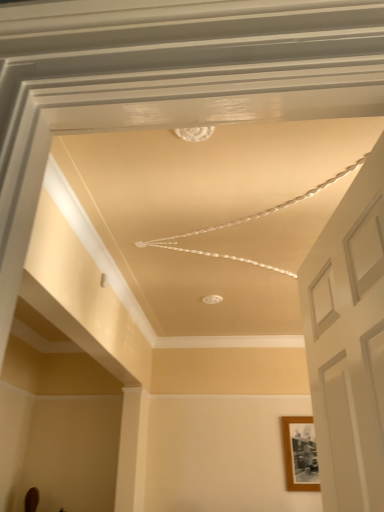
Based on the photo, what is the approximate height of white matte door at right?

It is 30.46 inches.

The width and height of the screenshot is (384, 512). I want to click on white matte door at right, so click(x=349, y=343).

This screenshot has width=384, height=512. Describe the element at coordinates (349, 343) in the screenshot. I see `white matte door at right` at that location.

This screenshot has width=384, height=512. What do you see at coordinates (300, 454) in the screenshot?
I see `wooden photo frame at right` at bounding box center [300, 454].

Locate an element on the screen. This screenshot has width=384, height=512. wooden photo frame at right is located at coordinates (300, 454).

I want to click on white matte door at right, so point(349,343).

Is white matte door at right at the left side of wooden photo frame at right?

Yes.

Does white matte door at right lie in front of wooden photo frame at right?

Yes, it is in front of wooden photo frame at right.

Does point (308, 311) come behind point (310, 442)?

That is False.

From the image's perspective, is white matte door at right above wooden photo frame at right?

Yes, from the image's perspective, white matte door at right is over wooden photo frame at right.

From a real-world perspective, is white matte door at right located higher than wooden photo frame at right?

Indeed, from a real-world perspective, white matte door at right stands above wooden photo frame at right.

Considering the sizes of objects white matte door at right and wooden photo frame at right in the image provided, who is thinner, white matte door at right or wooden photo frame at right?

Thinner between the two is wooden photo frame at right.

Does white matte door at right have a lesser height compared to wooden photo frame at right?

Incorrect, the height of white matte door at right does not fall short of that of wooden photo frame at right.

Which of these two, white matte door at right or wooden photo frame at right, is bigger?

white matte door at right is bigger.

Is white matte door at right positioned beyond the bounds of wooden photo frame at right?

Yes, white matte door at right is not within wooden photo frame at right.

Is white matte door at right with wooden photo frame at right?

They are not placed beside each other.

Is white matte door at right oriented towards wooden photo frame at right?

No.

What's the angular difference between white matte door at right and wooden photo frame at right's facing directions?

The angular difference between white matte door at right and wooden photo frame at right is 81.4 degrees.

Measure the distance from white matte door at right to wooden photo frame at right.

9.97 feet.

Find the location of `picture frame below the white matte door at right (from the image's perspective)`. picture frame below the white matte door at right (from the image's perspective) is located at coordinates (300, 454).

Between wooden photo frame at right and white matte door at right, which one appears on the left side from the viewer's perspective?

white matte door at right is more to the left.

Considering the positions of objects wooden photo frame at right and white matte door at right in the image provided, who is in front, wooden photo frame at right or white matte door at right?

white matte door at right is more forward.

Is point (296, 452) closer to camera compared to point (353, 215)?

That is False.

From the image's perspective, which object appears higher, wooden photo frame at right or white matte door at right?

white matte door at right, from the image's perspective.

Based on the photo, from a real-world perspective, is wooden photo frame at right over white matte door at right?

No, from a real-world perspective, wooden photo frame at right is not over white matte door at right

Considering the relative sizes of wooden photo frame at right and white matte door at right in the image provided, is wooden photo frame at right thinner than white matte door at right?

Indeed, wooden photo frame at right has a lesser width compared to white matte door at right.

Is wooden photo frame at right shorter than white matte door at right?

Indeed, wooden photo frame at right has a lesser height compared to white matte door at right.

Is wooden photo frame at right bigger than white matte door at right?

Incorrect, wooden photo frame at right is not larger than white matte door at right.

Can white matte door at right be found inside wooden photo frame at right?

No, wooden photo frame at right does not contain white matte door at right.

Is wooden photo frame at right placed right next to white matte door at right?

No, wooden photo frame at right is not touching white matte door at right.

Is wooden photo frame at right positioned with its back to white matte door at right?

wooden photo frame at right is not turned away from white matte door at right.

Measure the distance from wooden photo frame at right to white matte door at right.

wooden photo frame at right is 9.97 feet from white matte door at right.

Where is `door above the wooden photo frame at right (from the image's perspective)`? The image size is (384, 512). door above the wooden photo frame at right (from the image's perspective) is located at coordinates (349, 343).

You are a GUI agent. You are given a task and a screenshot of the screen. Output one action in this format:
    pyautogui.click(x=<x>, y=<y>)
    Task: Click on the picture frame behind the white matte door at right
    The width and height of the screenshot is (384, 512).
    Given the screenshot: What is the action you would take?
    coord(300,454)

At what (x,y) coordinates should I click in order to perform the action: click on picture frame on the right side of white matte door at right. Please return your answer as a coordinate pair (x, y). Looking at the image, I should click on (300, 454).